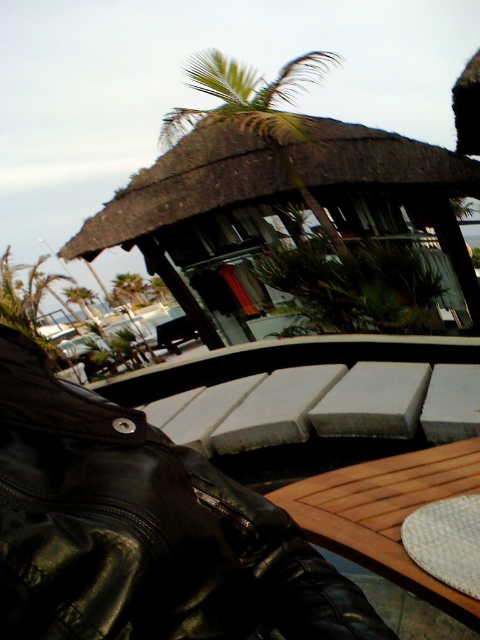
You are planning to set up an umbrella at the wooden table at lower center to provide shade. Given the position of the green leafy palm tree at upper center, will the tree block sunlight from reaching the table?

The wooden table at lower center is located below the green leafy palm tree at upper center, so the tree will block sunlight from reaching the table.

You are planning to set up a small garden between the brown thatched hut at upper center and the green leafy palm tree at upper center. Given that the distance between them is 8.32 meters, what is the maximum length of the garden path you can design to fit between them?

The maximum length of the garden path you can design between the brown thatched hut at upper center and the green leafy palm tree at upper center is 8.32 meters, as that is the distance between them.

You are planning to set up a small garden in the space between the wooden table at lower center and the green leafy palm tree at upper center. Considering their heights, which object will block sunlight to the garden more?

The green leafy palm tree at upper center will block sunlight more because it is taller than the wooden table at lower center.